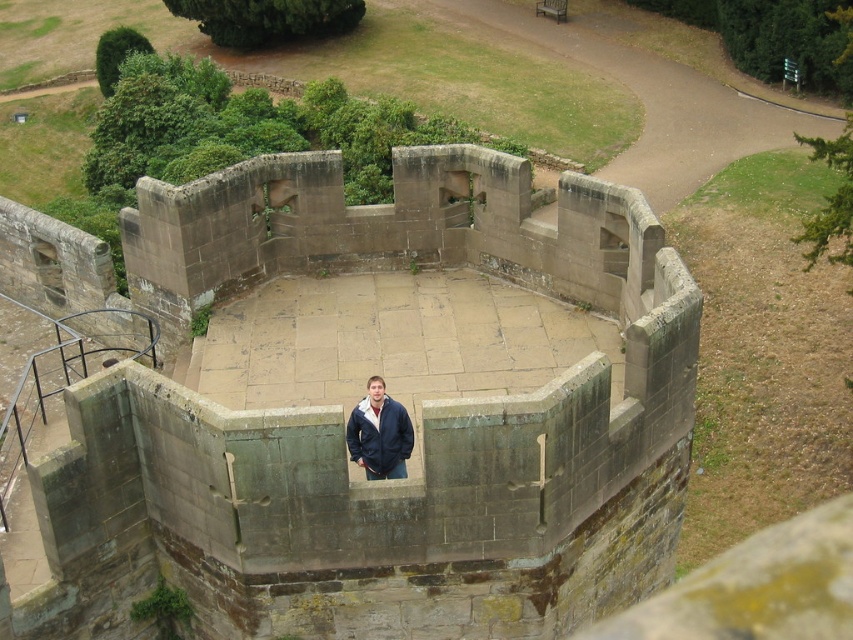
Can you confirm if stone wall at center is wider than navy blue jacket at center?

Yes.

Is stone wall at center below navy blue jacket at center?

No.

Locate an element on the screen. This screenshot has height=640, width=853. stone wall at center is located at coordinates click(343, 424).